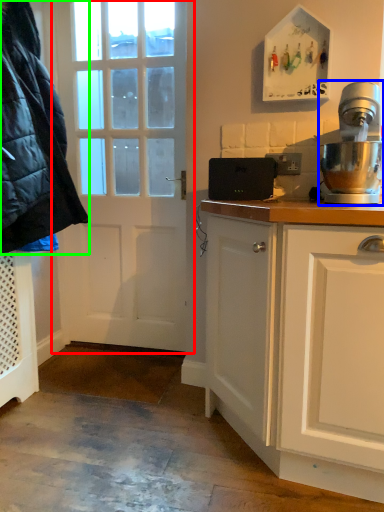
Question: Which object is the farthest from door (highlighted by a red box)? Choose among these: home appliance (highlighted by a blue box) or jacket (highlighted by a green box).

Choices:
 (A) home appliance
 (B) jacket

Answer: (A)